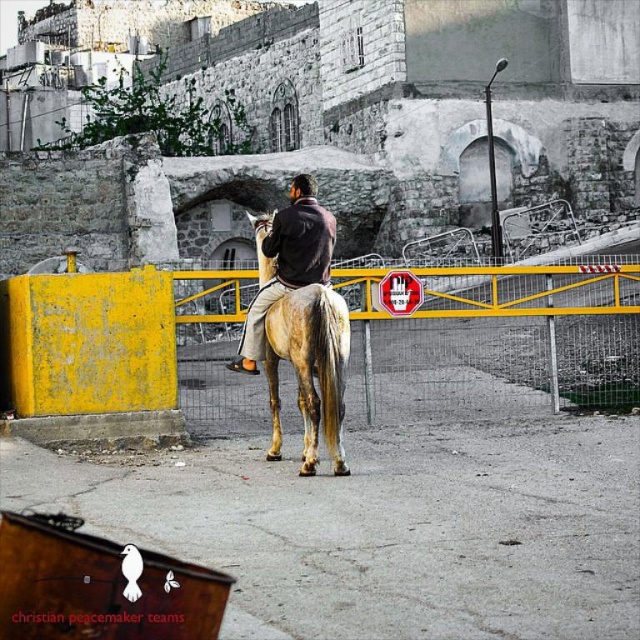
Question: Can you confirm if yellow metal fence at center is positioned above dark brown leather jacket at center?

Choices:
 (A) yes
 (B) no

Answer: (B)

Question: Which point is farther from the camera taking this photo?

Choices:
 (A) (275, 404)
 (B) (502, 380)
 (C) (257, 340)

Answer: (B)

Question: Which object is positioned farthest from the golden-brown horse at center?

Choices:
 (A) dark brown leather jacket at center
 (B) yellow metal fence at center

Answer: (B)

Question: Does yellow metal fence at center have a lesser width compared to dark brown leather jacket at center?

Choices:
 (A) yes
 (B) no

Answer: (B)

Question: Which of the following is the closest to the observer?

Choices:
 (A) (332, 248)
 (B) (266, 262)
 (C) (604, 282)

Answer: (A)

Question: Can you confirm if yellow metal fence at center is positioned to the left of golden-brown horse at center?

Choices:
 (A) no
 (B) yes

Answer: (A)